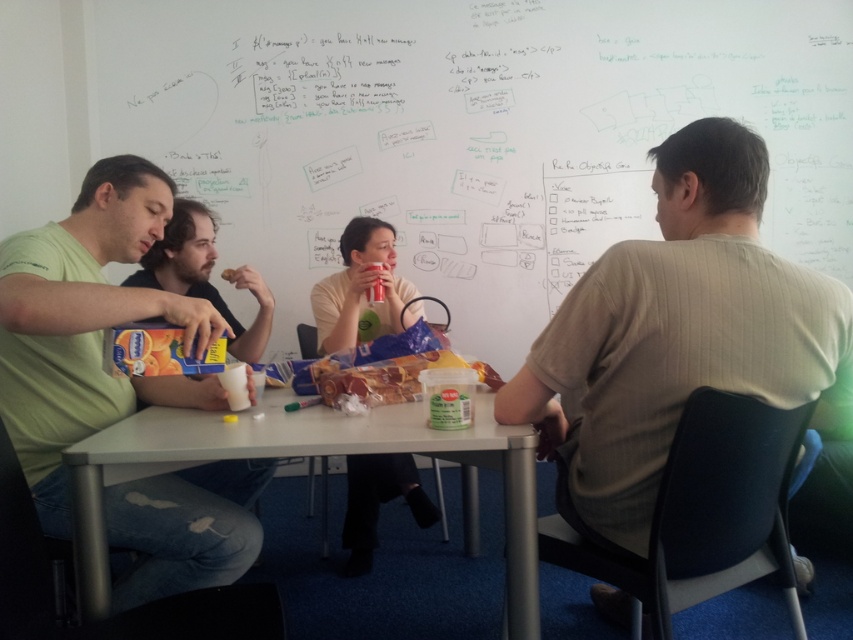
Question: Which object is positioned closest to the matte green t-shirt at left?

Choices:
 (A) matte red cup at center
 (B) whiteboard at upper center

Answer: (A)

Question: Which object appears closest to the camera in this image?

Choices:
 (A) whiteboard at upper center
 (B) matte green shirt at left
 (C) metallic silver table at center

Answer: (B)

Question: Among these objects, which one is farthest from the camera?

Choices:
 (A) whiteboard at upper center
 (B) matte green t-shirt at left

Answer: (A)

Question: Does light beige cotton shirt at upper right appear on the right side of matte green shirt at left?

Choices:
 (A) yes
 (B) no

Answer: (A)

Question: Can you confirm if whiteboard at upper center is positioned below light beige cotton shirt at upper right?

Choices:
 (A) yes
 (B) no

Answer: (B)

Question: Is metallic silver table at center to the left of matte green t-shirt at left from the viewer's perspective?

Choices:
 (A) no
 (B) yes

Answer: (A)